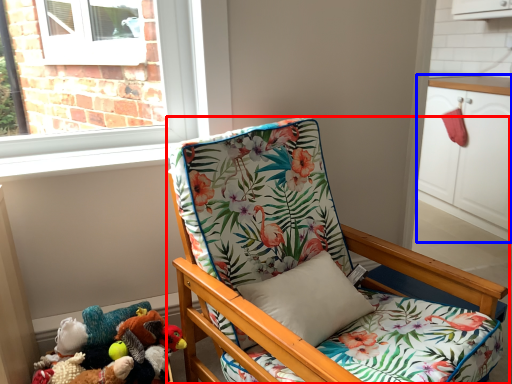
Question: Which object appears closest to the camera in this image, chair (highlighted by a red box) or cabinetry (highlighted by a blue box)?

Choices:
 (A) chair
 (B) cabinetry

Answer: (A)